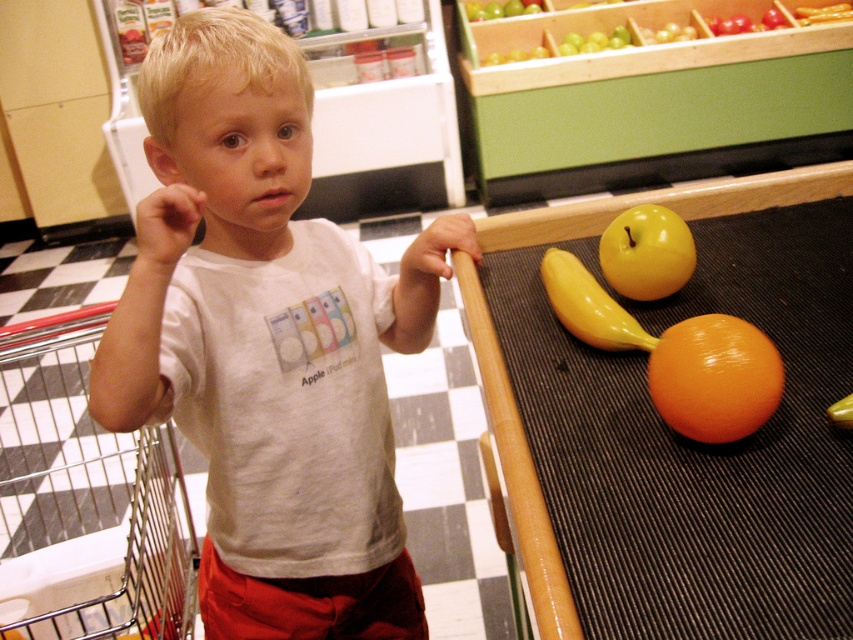
Question: Which of the following is the farthest from the observer?

Choices:
 (A) yellow rubber banana at center
 (B) metallic silver shopping cart at left
 (C) white cotton shirt at center

Answer: (B)

Question: Based on their relative distances, which object is nearer to the glossy orange at lower right?

Choices:
 (A) white cotton shirt at center
 (B) yellow shiny apple at upper right
 (C) yellow rubber banana at center

Answer: (C)

Question: Which object is closer to the camera taking this photo?

Choices:
 (A) yellow rubber banana at center
 (B) glossy orange at lower right
 (C) white cotton shirt at center
 (D) yellow shiny apple at upper right

Answer: (C)

Question: Does glossy orange at lower right have a greater width compared to yellow rubber banana at center?

Choices:
 (A) no
 (B) yes

Answer: (B)

Question: Does glossy orange at lower right have a lesser width compared to yellow rubber banana at center?

Choices:
 (A) no
 (B) yes

Answer: (A)

Question: Is yellow shiny apple at upper right bigger than yellow rubber banana at center?

Choices:
 (A) yes
 (B) no

Answer: (B)